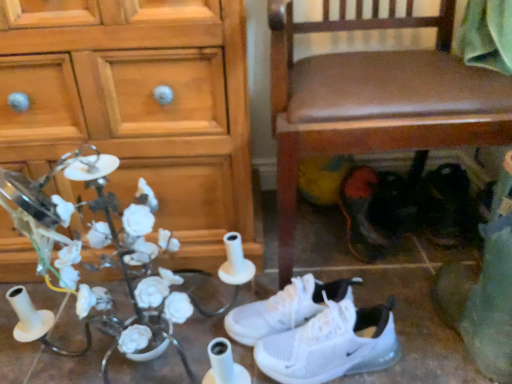
Identify the location of black leather shoes at lower right, placed as the first footwear when sorted from right to left. The height and width of the screenshot is (384, 512). (447, 206).

This screenshot has width=512, height=384. What do you see at coordinates (447, 206) in the screenshot?
I see `black leather shoes at lower right, which is the fourth footwear in left-to-right order` at bounding box center [447, 206].

This screenshot has width=512, height=384. I want to click on wooden cabinet at left, so click(x=139, y=106).

The height and width of the screenshot is (384, 512). What do you see at coordinates (368, 215) in the screenshot?
I see `dark red leather shoes at lower right, the 2th footwear in the right-to-left sequence` at bounding box center [368, 215].

You are a GUI agent. You are given a task and a screenshot of the screen. Output one action in this format:
    pyautogui.click(x=<x>, y=<y>)
    Task: Click on the black leather shoes at lower right, placed as the first footwear when sorted from right to left
    
    Given the screenshot: What is the action you would take?
    pyautogui.click(x=447, y=206)

From the image's perspective, is brown leather chair at lower right above white mesh sneakers at lower center, the second footwear viewed from the left?

Yes, from the image's perspective, brown leather chair at lower right is over white mesh sneakers at lower center, the second footwear viewed from the left.

Can you confirm if brown leather chair at lower right is smaller than white mesh sneakers at lower center, the second footwear viewed from the left?

No, brown leather chair at lower right is not smaller than white mesh sneakers at lower center, the second footwear viewed from the left.

In terms of width, does brown leather chair at lower right look wider or thinner when compared to white mesh sneakers at lower center, which is the third footwear in right-to-left order?

Considering their sizes, brown leather chair at lower right looks broader than white mesh sneakers at lower center, which is the third footwear in right-to-left order.

Is brown leather chair at lower right positioned with its back to white mesh sneakers at lower center, the second footwear viewed from the left?

brown leather chair at lower right does not have its back to white mesh sneakers at lower center, the second footwear viewed from the left.

Can you confirm if white mesh sneakers at center, which is the 4th footwear in right-to-left order, is smaller than white ceramic flowers at left?

Correct, white mesh sneakers at center, which is the 4th footwear in right-to-left order, occupies less space than white ceramic flowers at left.

Considering the relative sizes of white mesh sneakers at center, the 1th footwear from the left, and white ceramic flowers at left in the image provided, is white mesh sneakers at center, the 1th footwear from the left, shorter than white ceramic flowers at left?

Yes.

Is white mesh sneakers at center, the 1th footwear from the left, facing away from white ceramic flowers at left?

No.

Considering the positions of objects white mesh sneakers at lower center, which is the third footwear in right-to-left order, and wooden cabinet at left in the image provided, who is more to the right, white mesh sneakers at lower center, which is the third footwear in right-to-left order, or wooden cabinet at left?

From the viewer's perspective, white mesh sneakers at lower center, which is the third footwear in right-to-left order, appears more on the right side.

Is white mesh sneakers at lower center, the second footwear viewed from the left, positioned far away from wooden cabinet at left?

No.

Is white mesh sneakers at lower center, the second footwear viewed from the left, further to camera compared to wooden cabinet at left?

No, white mesh sneakers at lower center, the second footwear viewed from the left, is closer to the camera.

Looking at this image, does white mesh sneakers at lower center, which is the third footwear in right-to-left order, have a lesser width compared to wooden cabinet at left?

Yes.

Which of these two, dark red leather shoes at lower right, the 3th footwear in the left-to-right sequence, or white mesh sneakers at center, the 1th footwear from the left, is thinner?

dark red leather shoes at lower right, the 3th footwear in the left-to-right sequence, is thinner.

Is dark red leather shoes at lower right, the 3th footwear in the left-to-right sequence, bigger or smaller than white mesh sneakers at center, which is the 4th footwear in right-to-left order?

Considering their sizes, dark red leather shoes at lower right, the 3th footwear in the left-to-right sequence, takes up more space than white mesh sneakers at center, which is the 4th footwear in right-to-left order.

Does dark red leather shoes at lower right, the 3th footwear in the left-to-right sequence, come in front of white mesh sneakers at center, the 1th footwear from the left?

No, dark red leather shoes at lower right, the 3th footwear in the left-to-right sequence, is further to the viewer.

Is dark red leather shoes at lower right, the 2th footwear in the right-to-left sequence, surrounding white mesh sneakers at center, which is the 4th footwear in right-to-left order?

No, white mesh sneakers at center, which is the 4th footwear in right-to-left order, is not a part of dark red leather shoes at lower right, the 2th footwear in the right-to-left sequence.

Considering the relative positions of dark red leather shoes at lower right, the 3th footwear in the left-to-right sequence, and white ceramic flowers at left in the image provided, is dark red leather shoes at lower right, the 3th footwear in the left-to-right sequence, to the right of white ceramic flowers at left from the viewer's perspective?

Indeed, dark red leather shoes at lower right, the 3th footwear in the left-to-right sequence, is positioned on the right side of white ceramic flowers at left.

Does point (384, 226) lie behind point (179, 306)?

Yes, point (384, 226) is behind point (179, 306).

In the image, there is a dark red leather shoes at lower right, the 2th footwear in the right-to-left sequence. Identify the location of floral arrangement below it (from the image's perspective). The image size is (512, 384). (101, 248).

Does dark red leather shoes at lower right, the 3th footwear in the left-to-right sequence, lie in front of white ceramic flowers at left?

No, dark red leather shoes at lower right, the 3th footwear in the left-to-right sequence, is further to the viewer.

Is black leather shoes at lower right, placed as the first footwear when sorted from right to left, smaller than dark red leather shoes at lower right, the 3th footwear in the left-to-right sequence?

Yes.

Is black leather shoes at lower right, placed as the first footwear when sorted from right to left, facing towards dark red leather shoes at lower right, the 3th footwear in the left-to-right sequence?

No.

Is white mesh sneakers at lower center, the second footwear viewed from the left, inside white mesh sneakers at center, the 1th footwear from the left?

No, white mesh sneakers at center, the 1th footwear from the left, does not contain white mesh sneakers at lower center, the second footwear viewed from the left.

Between point (247, 308) and point (255, 348), which one is positioned in front?

The point (255, 348) is in front.

The width and height of the screenshot is (512, 384). I want to click on footwear in front of the white mesh sneakers at center, which is the 4th footwear in right-to-left order, so click(x=332, y=344).

Where is `chair above the white mesh sneakers at lower center, which is the third footwear in right-to-left order (from the image's perspective)`? The width and height of the screenshot is (512, 384). chair above the white mesh sneakers at lower center, which is the third footwear in right-to-left order (from the image's perspective) is located at coordinates (373, 99).

From a real-world perspective, count 4th footwears downward from the white ceramic flowers at left and point to it. Please provide its 2D coordinates.

[(285, 308)]

Estimate the real-world distances between objects in this image. Which object is closer to white mesh sneakers at lower center, the second footwear viewed from the left, white ceramic flowers at left or wooden cabinet at left?

The object closer to white mesh sneakers at lower center, the second footwear viewed from the left, is white ceramic flowers at left.

Which object lies further to the anchor point white ceramic flowers at left, white mesh sneakers at center, which is the 4th footwear in right-to-left order, or black leather shoes at lower right, which is the fourth footwear in left-to-right order?

Based on the image, black leather shoes at lower right, which is the fourth footwear in left-to-right order, appears to be further to white ceramic flowers at left.

Based on their spatial positions, is dark red leather shoes at lower right, the 3th footwear in the left-to-right sequence, or white mesh sneakers at lower center, which is the third footwear in right-to-left order, further from black leather shoes at lower right, placed as the first footwear when sorted from right to left?

The object further to black leather shoes at lower right, placed as the first footwear when sorted from right to left, is white mesh sneakers at lower center, which is the third footwear in right-to-left order.

Estimate the real-world distances between objects in this image. Which object is closer to dark red leather shoes at lower right, the 3th footwear in the left-to-right sequence, black leather shoes at lower right, which is the fourth footwear in left-to-right order, or white mesh sneakers at lower center, which is the third footwear in right-to-left order?

Among the two, black leather shoes at lower right, which is the fourth footwear in left-to-right order, is located nearer to dark red leather shoes at lower right, the 3th footwear in the left-to-right sequence.

Looking at the image, which one is located closer to white ceramic flowers at left, dark red leather shoes at lower right, the 2th footwear in the right-to-left sequence, or black leather shoes at lower right, which is the fourth footwear in left-to-right order?

dark red leather shoes at lower right, the 2th footwear in the right-to-left sequence, is closer to white ceramic flowers at left.

Estimate the real-world distances between objects in this image. Which object is closer to wooden cabinet at left, black leather shoes at lower right, placed as the first footwear when sorted from right to left, or white mesh sneakers at center, the 1th footwear from the left?

white mesh sneakers at center, the 1th footwear from the left.

When comparing their distances from white ceramic flowers at left, does white mesh sneakers at lower center, which is the third footwear in right-to-left order, or dark red leather shoes at lower right, the 3th footwear in the left-to-right sequence, seem closer?

white mesh sneakers at lower center, which is the third footwear in right-to-left order, lies closer to white ceramic flowers at left than the other object.

Estimate the real-world distances between objects in this image. Which object is further from wooden cabinet at left, white ceramic flowers at left or white mesh sneakers at lower center, which is the third footwear in right-to-left order?

white mesh sneakers at lower center, which is the third footwear in right-to-left order.

Where is `floral arrangement between wooden cabinet at left and black leather shoes at lower right, placed as the first footwear when sorted from right to left, in the horizontal direction`? Image resolution: width=512 pixels, height=384 pixels. floral arrangement between wooden cabinet at left and black leather shoes at lower right, placed as the first footwear when sorted from right to left, in the horizontal direction is located at coordinates (101, 248).

The height and width of the screenshot is (384, 512). I want to click on chair between wooden cabinet at left and black leather shoes at lower right, which is the fourth footwear in left-to-right order, from left to right, so click(373, 99).

Locate an element on the screen. This screenshot has height=384, width=512. chair located between white mesh sneakers at center, which is the 4th footwear in right-to-left order, and black leather shoes at lower right, which is the fourth footwear in left-to-right order, in the left-right direction is located at coordinates (373, 99).

Where is `footwear between wooden cabinet at left and white mesh sneakers at lower center, which is the third footwear in right-to-left order`? The width and height of the screenshot is (512, 384). footwear between wooden cabinet at left and white mesh sneakers at lower center, which is the third footwear in right-to-left order is located at coordinates (285, 308).